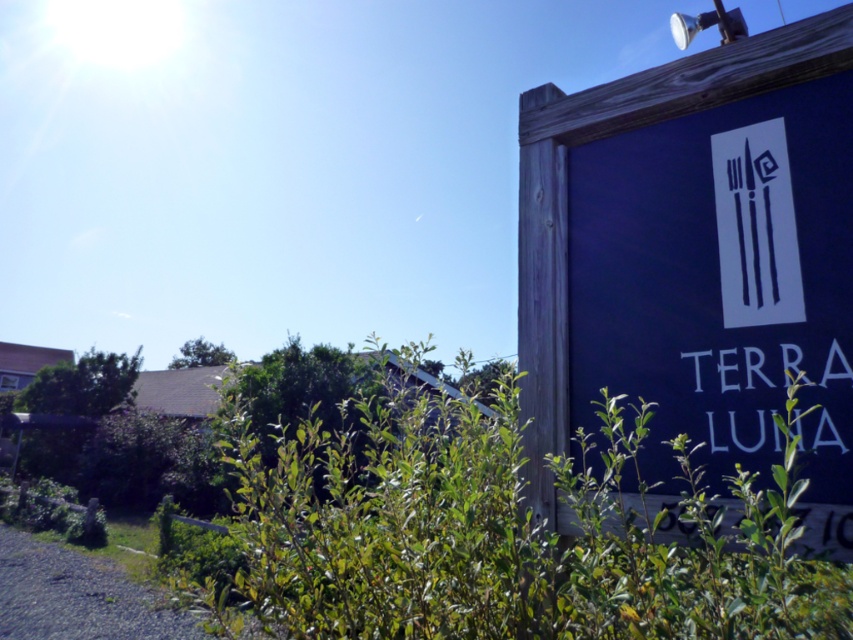
Question: Which point appears closest to the camera in this image?

Choices:
 (A) (735, 557)
 (B) (778, 305)

Answer: (B)

Question: Does dark blue wooden sign at upper right appear on the right side of green leafy bush at lower center?

Choices:
 (A) no
 (B) yes

Answer: (B)

Question: Which point is closer to the camera?

Choices:
 (A) green leafy bush at lower center
 (B) dark blue wooden sign at upper right

Answer: (A)

Question: Which object appears farthest from the camera in this image?

Choices:
 (A) dark blue wooden sign at upper right
 (B) green leafy bush at lower center

Answer: (A)

Question: Where is dark blue wooden sign at upper right located in relation to green leafy bush at lower center in the image?

Choices:
 (A) right
 (B) left

Answer: (A)

Question: Does dark blue wooden sign at upper right appear over green leafy bush at lower center?

Choices:
 (A) no
 (B) yes

Answer: (B)